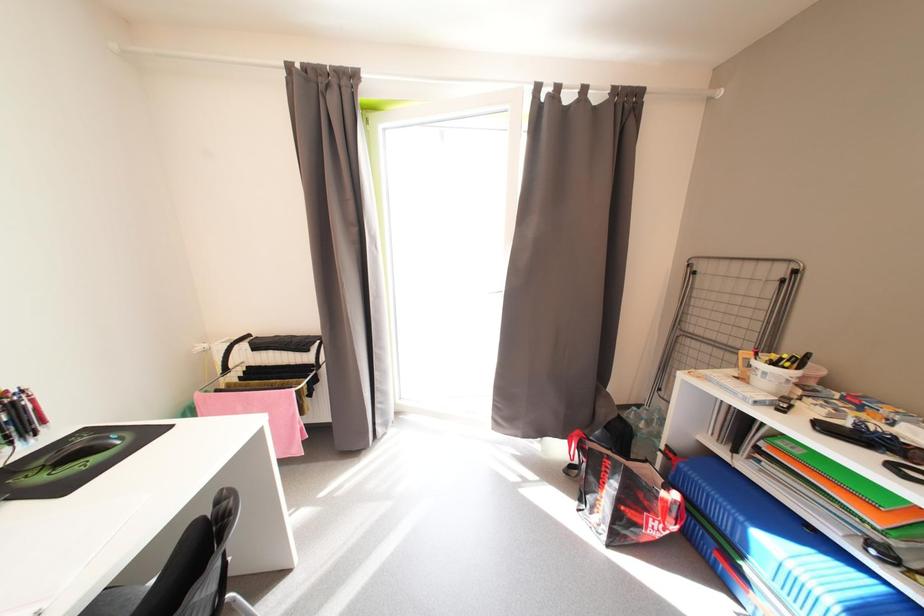
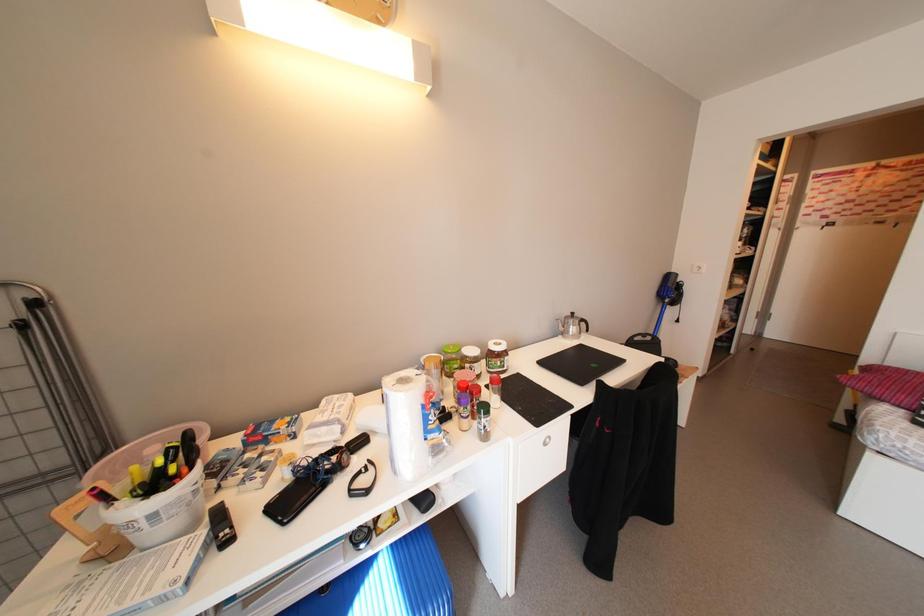
The first image is from the beginning of the video and the second image is from the end. How did the camera likely rotate when shooting the video?

The camera's rotation is toward right-down.